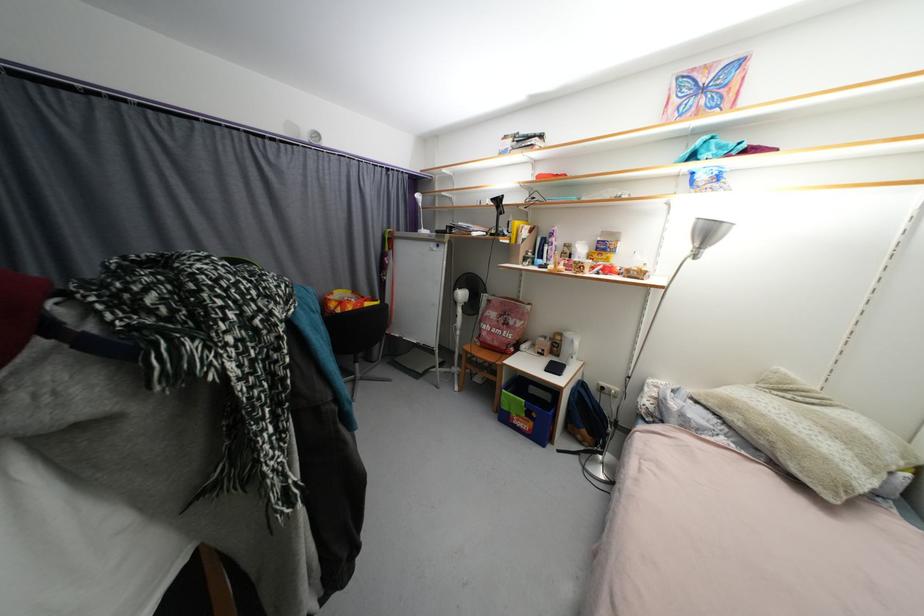
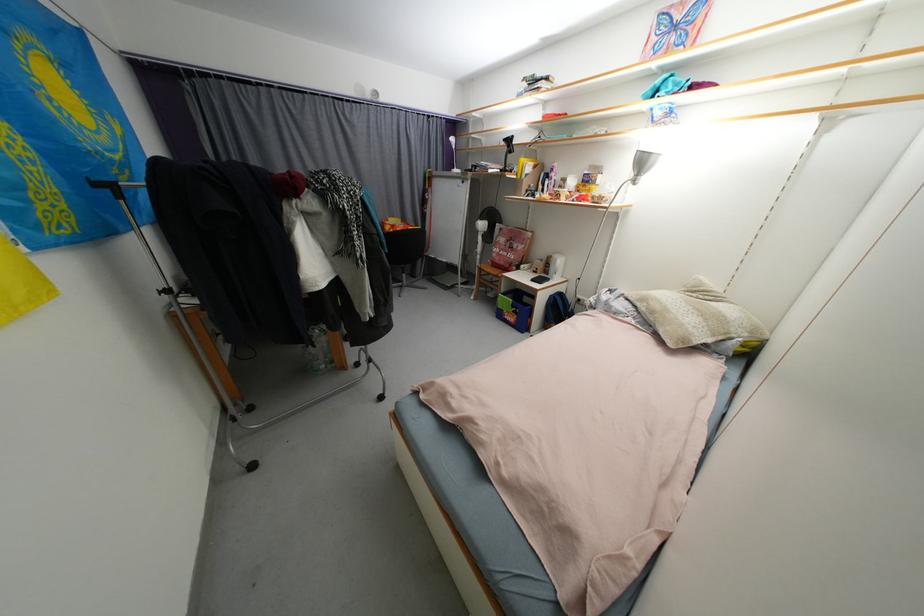
Find the pixel in the second image that matches point 712,236 in the first image.

(648, 164)